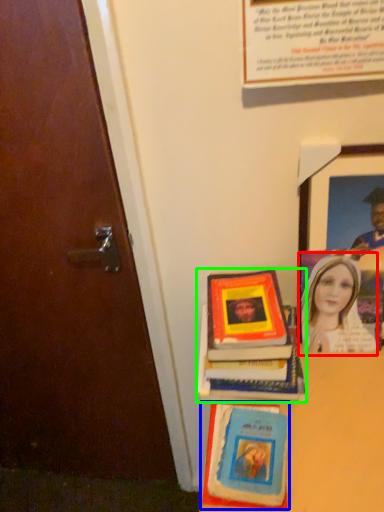
Question: Which object is positioned closest to woman (highlighted by a red box)? Select from book cover (highlighted by a blue box) and book (highlighted by a green box).

Choices:
 (A) book cover
 (B) book

Answer: (B)